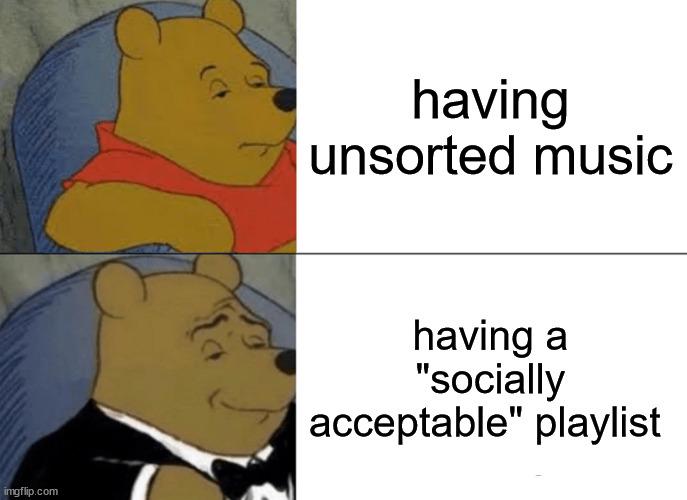
Image resolution: width=687 pixels, height=500 pixels. I want to click on chair back, so click(31, 341), click(58, 84).